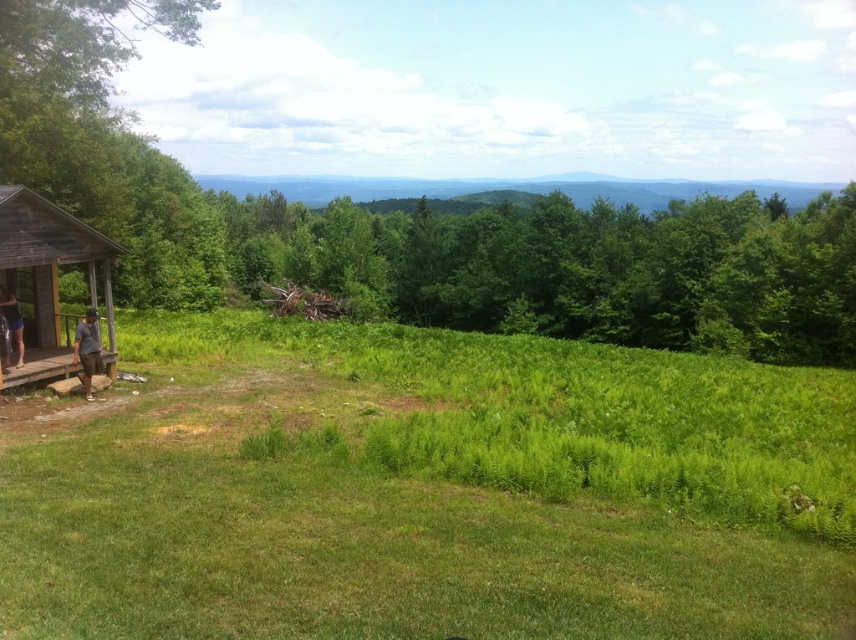
Question: Does brown wooden porch at lower left appear on the right side of blue denim shorts at lower left?

Choices:
 (A) yes
 (B) no

Answer: (A)

Question: Can you confirm if brown wooden hut at lower left is positioned above dark gray shirt at lower left?

Choices:
 (A) no
 (B) yes

Answer: (B)

Question: Can you confirm if dark gray shirt at lower left is positioned below blue denim shorts at lower left?

Choices:
 (A) yes
 (B) no

Answer: (A)

Question: Which object is farther from the camera taking this photo?

Choices:
 (A) blue denim shorts at lower left
 (B) brown wooden hut at lower left

Answer: (A)

Question: Which point is closer to the camera taking this photo?

Choices:
 (A) (21, 365)
 (B) (96, 323)
 (C) (67, 374)

Answer: (B)

Question: Estimate the real-world distances between objects in this image. Which object is farther from the dark gray shirt at lower left?

Choices:
 (A) blue denim shorts at lower left
 (B) brown wooden hut at lower left

Answer: (B)